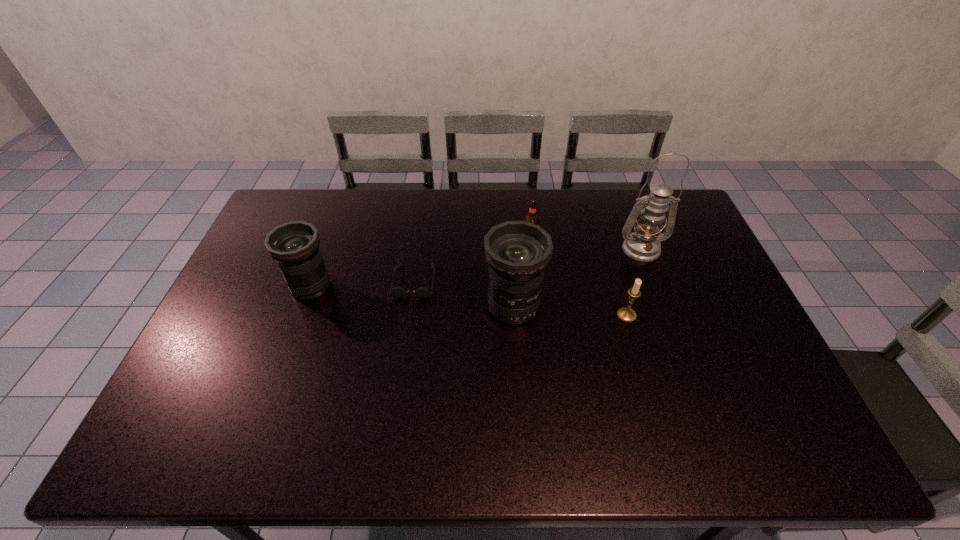
You are a GUI agent. You are given a task and a screenshot of the screen. Output one action in this format:
    pyautogui.click(x=<x>, y=<y>)
    Task: Click on the empty location between the fourth shortest object and the taller telephoto lens
    
    Given the screenshot: What is the action you would take?
    pyautogui.click(x=412, y=296)

Image resolution: width=960 pixels, height=540 pixels. In order to click on object that is the third closest one to the right telephoto lens in this screenshot , I will do `click(626, 314)`.

Locate which object is the second closest to the fifth object from right to left. Please provide its 2D coordinates. Your answer should be formatted as a tuple, i.e. [(x, y)], where the tuple contains the x and y coordinates of a point satisfying the conditions above.

[(294, 246)]

Find the location of a particular element. The width and height of the screenshot is (960, 540). free location that satisfies the following two spatial constraints: 1. on the front side of the second object from right to left; 2. on the left side of the right telephoto lens is located at coordinates (514, 315).

Identify the location of free space that satisfies the following two spatial constraints: 1. on the back side of the leftmost object; 2. on the left side of the root beer. (328, 238).

Where is `vacant region that satisfies the following two spatial constraints: 1. on the front side of the fourth shortest object; 2. on the left side of the candle holder`? This screenshot has height=540, width=960. vacant region that satisfies the following two spatial constraints: 1. on the front side of the fourth shortest object; 2. on the left side of the candle holder is located at coordinates (300, 315).

Locate an element on the screen. The height and width of the screenshot is (540, 960). free space that satisfies the following two spatial constraints: 1. on the back side of the candle holder; 2. on the right side of the oil lamp is located at coordinates (607, 249).